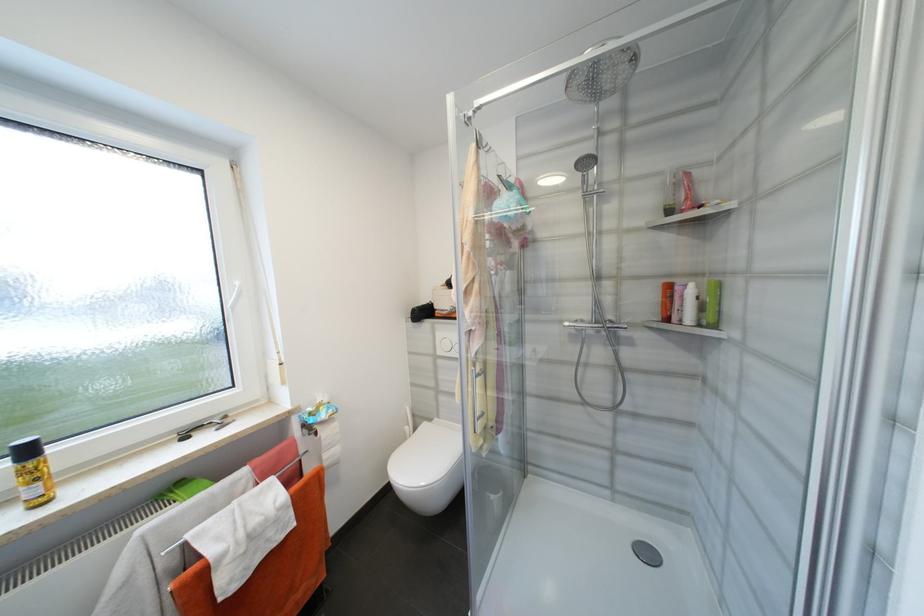
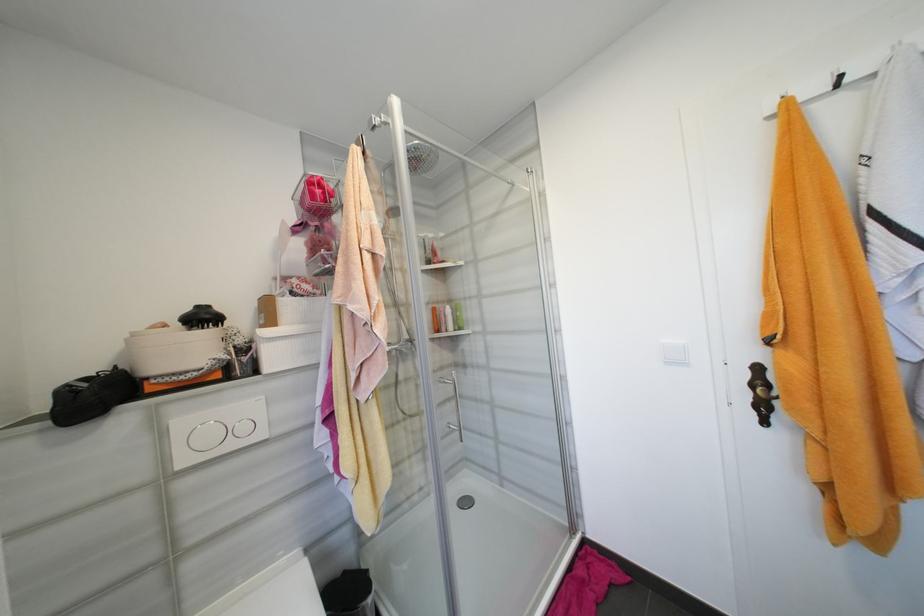
Where in the second image is the point corresponding to (x=679, y=320) from the first image?

(450, 330)